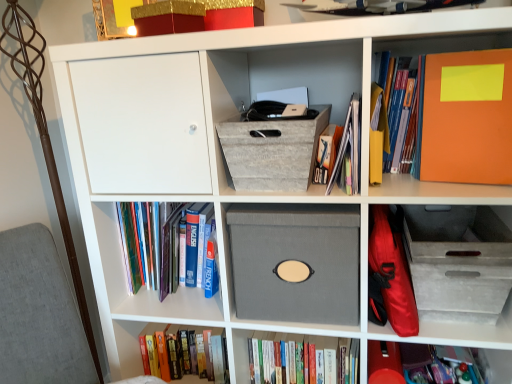
Question: Can hardcover book at upper right, the first book viewed from the top, be found inside yellow paper at upper right, marked as the 2th paperback book in a right-to-left arrangement?

Choices:
 (A) no
 (B) yes

Answer: (A)

Question: From a real-world perspective, is yellow paper at upper right, marked as the 2th paperback book in a right-to-left arrangement, positioned over hardcover book at upper right, the first book viewed from the top, based on gravity?

Choices:
 (A) yes
 (B) no

Answer: (B)

Question: From the image's perspective, is yellow paper at upper right, marked as the 2th paperback book in a right-to-left arrangement, over hardcover book at upper right, the first book viewed from the top?

Choices:
 (A) yes
 (B) no

Answer: (B)

Question: Considering the relative sizes of yellow paper at upper right, marked as the 2th paperback book in a right-to-left arrangement, and hardcover book at upper right, the first book viewed from the top, in the image provided, is yellow paper at upper right, marked as the 2th paperback book in a right-to-left arrangement, wider than hardcover book at upper right, the first book viewed from the top,?

Choices:
 (A) yes
 (B) no

Answer: (A)

Question: Is yellow paper at upper right, marked as the 2th paperback book in a right-to-left arrangement, with hardcover book at upper right, which is counted as the 6th book, starting from the bottom?

Choices:
 (A) no
 (B) yes

Answer: (B)

Question: Considering the positions of point (328, 188) and point (148, 246), is point (328, 188) closer or farther from the camera than point (148, 246)?

Choices:
 (A) closer
 (B) farther

Answer: (A)

Question: Do you think matte orange folder at upper right, the 2th book in the top-to-bottom sequence, is within hardcover books at left, the fourth book positioned from the bottom, or outside of it?

Choices:
 (A) inside
 (B) outside

Answer: (B)

Question: Looking at their shapes, would you say matte orange folder at upper right, the 2th book in the top-to-bottom sequence, is wider or thinner than hardcover books at left, the fourth book positioned from the bottom?

Choices:
 (A) wide
 (B) thin

Answer: (A)

Question: Considering the relative positions of matte orange folder at upper right, the 2th book in the top-to-bottom sequence, and hardcover books at left, the 3th book in the top-to-bottom sequence, in the image provided, is matte orange folder at upper right, the 2th book in the top-to-bottom sequence, to the left or to the right of hardcover books at left, the 3th book in the top-to-bottom sequence,?

Choices:
 (A) left
 (B) right

Answer: (B)

Question: Considering the positions of matte red book at lower right, which ranks as the fifth book in top-to-bottom order, and yellow paper at upper right, marked as the 2th paperback book in a right-to-left arrangement, in the image, is matte red book at lower right, which ranks as the fifth book in top-to-bottom order, wider or thinner than yellow paper at upper right, marked as the 2th paperback book in a right-to-left arrangement,?

Choices:
 (A) wide
 (B) thin

Answer: (A)

Question: Is matte red book at lower right, the 2th book when ordered from bottom to top, bigger or smaller than yellow paper at upper right, which is the 1th paperback book from left to right?

Choices:
 (A) big
 (B) small

Answer: (A)

Question: Do you think matte red book at lower right, which ranks as the fifth book in top-to-bottom order, is within yellow paper at upper right, marked as the 2th paperback book in a right-to-left arrangement, or outside of it?

Choices:
 (A) outside
 (B) inside

Answer: (A)

Question: In the image, is matte red book at lower right, which ranks as the fifth book in top-to-bottom order, positioned in front of or behind yellow paper at upper right, marked as the 2th paperback book in a right-to-left arrangement?

Choices:
 (A) behind
 (B) front

Answer: (A)

Question: From the image's perspective, is hardcover book at lower center, which ranks as the third book in bottom-to-top order, positioned above or below matte orange folder at upper right, the fifth book positioned from the bottom?

Choices:
 (A) below
 (B) above

Answer: (A)

Question: Based on their sizes in the image, would you say hardcover book at lower center, which ranks as the third book in bottom-to-top order, is bigger or smaller than matte orange folder at upper right, the 2th book in the top-to-bottom sequence?

Choices:
 (A) small
 (B) big

Answer: (B)